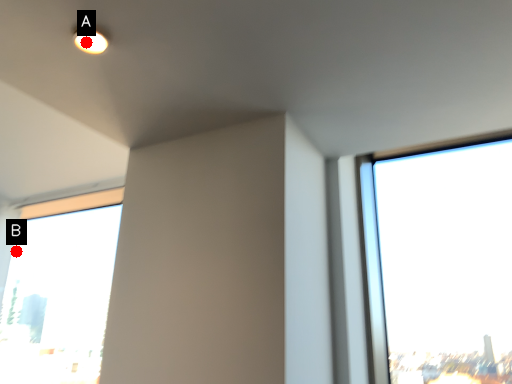
Question: Two points are circled on the image, labeled by A and B beside each circle. Which point is closer to the camera taking this photo?

Choices:
 (A) A is closer
 (B) B is closer

Answer: (A)